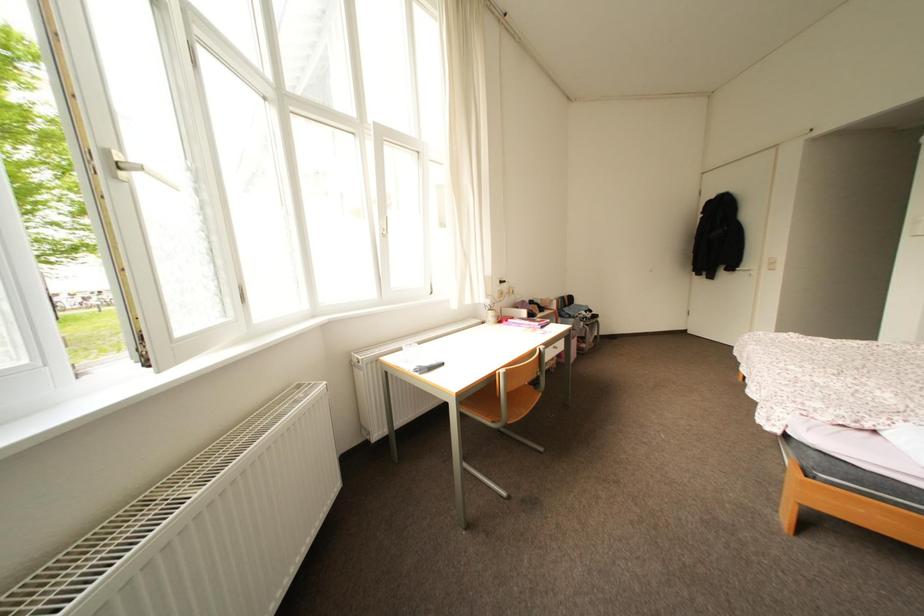
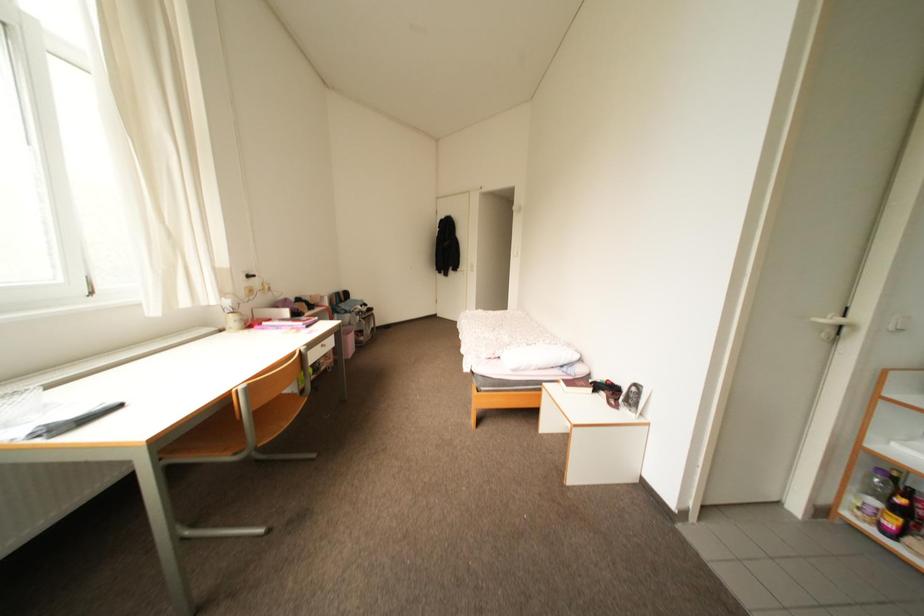
Question: The images are taken continuously from a first-person perspective. In which direction is your viewpoint rotating?

Choices:
 (A) Left
 (B) Right
 (C) Up
 (D) Down

Answer: (B)